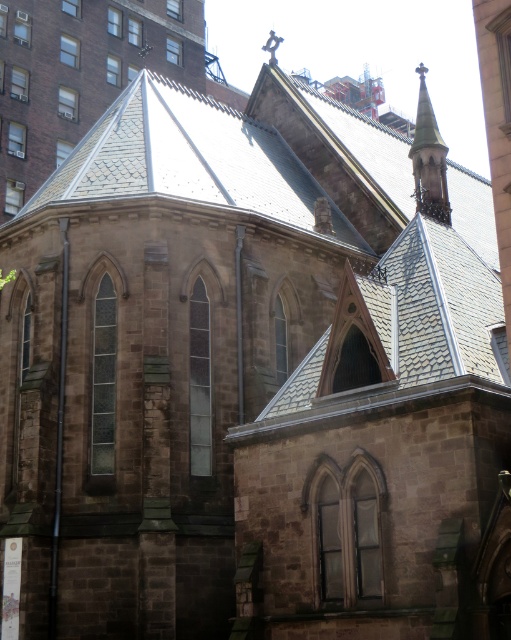
Question: Does gray slate roof at upper center appear over smooth stone spire at upper right?

Choices:
 (A) yes
 (B) no

Answer: (B)

Question: Can you confirm if gray slate roof at upper center is wider than smooth stone spire at upper right?

Choices:
 (A) yes
 (B) no

Answer: (A)

Question: Can you confirm if gray slate roof at upper center is positioned to the right of smooth stone spire at upper right?

Choices:
 (A) yes
 (B) no

Answer: (B)

Question: Among these objects, which one is nearest to the camera?

Choices:
 (A) gray slate roof at upper center
 (B) smooth stone spire at upper right

Answer: (A)

Question: Which object is closer to the camera taking this photo?

Choices:
 (A) gray slate roof at upper center
 (B) smooth stone spire at upper right

Answer: (A)